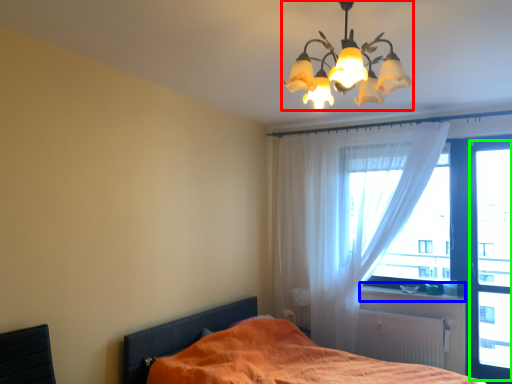
Question: Estimate the real-world distances between objects in this image. Which object is closer to lamp (highlighted by a red box), window sill (highlighted by a blue box) or window screen (highlighted by a green box)?

Choices:
 (A) window sill
 (B) window screen

Answer: (B)